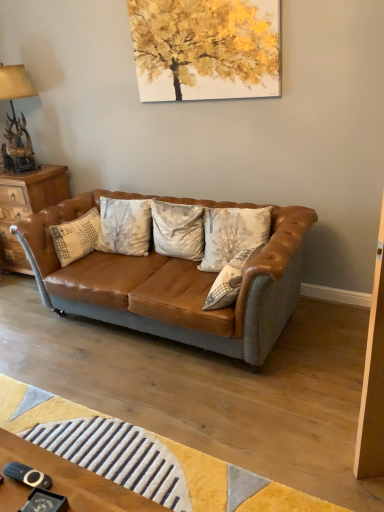
At what (x,y) coordinates should I click in order to perform the action: click on empty space that is ontop of yellow woolen mat at lower center (from a real-world perspective). Please return your answer as a coordinate pair (x, y). Looking at the image, I should click on (121, 448).